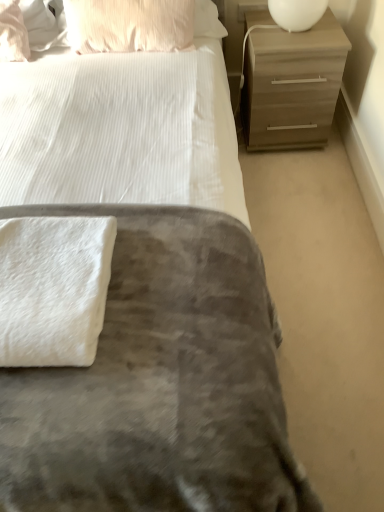
Question: Is white fluffy bath towel at lower left taller or shorter than matte brown chest of drawers at upper right?

Choices:
 (A) short
 (B) tall

Answer: (A)

Question: Visually, is white fluffy bath towel at lower left positioned to the left or to the right of matte brown chest of drawers at upper right?

Choices:
 (A) right
 (B) left

Answer: (B)

Question: Which is nearer to the pink textured pillow at upper left, the first pillow in the right-to-left sequence?

Choices:
 (A) matte pink pillow at upper left, acting as the first pillow starting from the left
 (B) white glossy lampshade at upper right
 (C) white fluffy bath towel at lower left
 (D) matte brown chest of drawers at upper right

Answer: (A)

Question: Which is nearer to the pink textured pillow at upper left, the 2th pillow when ordered from left to right?

Choices:
 (A) white fluffy bath towel at lower left
 (B) white glossy lampshade at upper right
 (C) matte brown chest of drawers at upper right
 (D) matte pink pillow at upper left, acting as the first pillow starting from the left

Answer: (D)